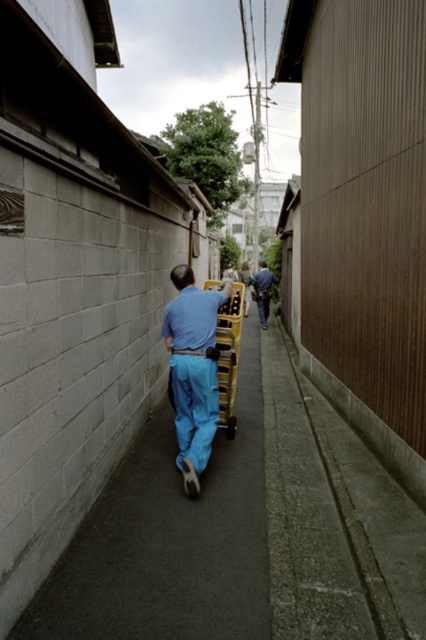
Between smooth asphalt pavement at center and blue jeans at center, which one is positioned lower?

smooth asphalt pavement at center

Is point (221, 589) closer to viewer compared to point (262, 276)?

Yes, it is in front of point (262, 276).

You are a GUI agent. You are given a task and a screenshot of the screen. Output one action in this format:
    pyautogui.click(x=<x>, y=<y>)
    Task: Click on the smooth asphalt pavement at center
    
    Given the screenshot: What is the action you would take?
    pyautogui.click(x=169, y=540)

Can you confirm if smooth asphalt pavement at center is positioned to the right of blue fabric pants at center?

No, smooth asphalt pavement at center is not to the right of blue fabric pants at center.

What do you see at coordinates (169, 540) in the screenshot? I see `smooth asphalt pavement at center` at bounding box center [169, 540].

Identify the location of smooth asphalt pavement at center. (169, 540).

Where is `smooth asphalt pavement at center`? The image size is (426, 640). smooth asphalt pavement at center is located at coordinates (169, 540).

Is blue jeans at center to the left of blue fabric pants at center from the viewer's perspective?

No, blue jeans at center is not to the left of blue fabric pants at center.

Who is higher up, blue jeans at center or blue fabric pants at center?

blue fabric pants at center is above.

Is point (259, 273) positioned after point (230, 276)?

That is False.

Locate an element on the screen. blue jeans at center is located at coordinates (262, 291).